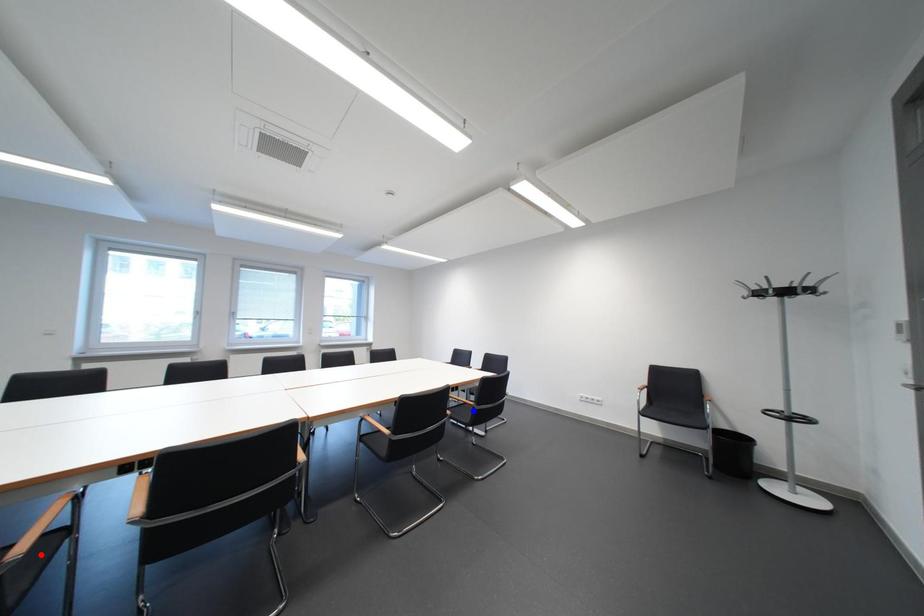
Question: Two points are marked on the image. Which point is closer to the camera?

Choices:
 (A) Blue point is closer.
 (B) Red point is closer.

Answer: (B)